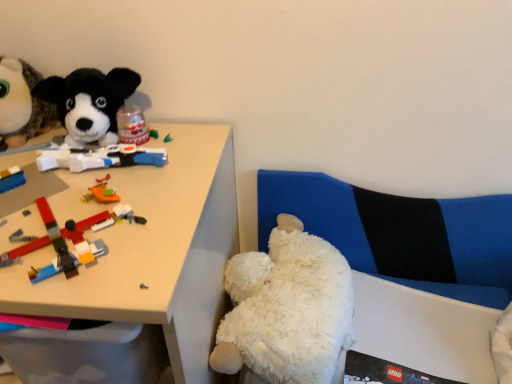
Locate an element on the screen. Image resolution: width=512 pixels, height=384 pixels. free point below brick-like plastic toys at left, which is the 2th toy from top to bottom (from a real-world perspective) is located at coordinates (57, 229).